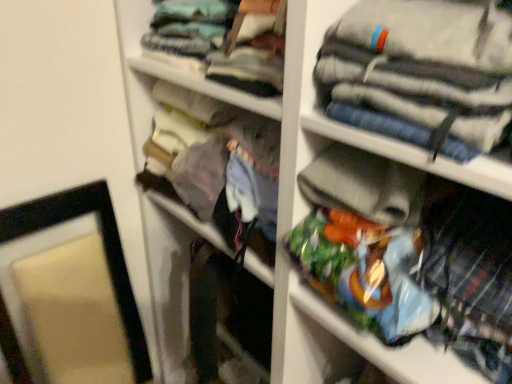
Question: In terms of height, does matte black picture frame at left look taller or shorter compared to light blue fabric at upper center, which is the 1th clothing in top-to-bottom order?

Choices:
 (A) short
 (B) tall

Answer: (B)

Question: Would you say matte black picture frame at left is to the left or to the right of light blue fabric at upper center, which is the 1th clothing in top-to-bottom order, in the picture?

Choices:
 (A) left
 (B) right

Answer: (A)

Question: Estimate the real-world distances between objects in this image. Which object is closer to the matte black picture frame at left?

Choices:
 (A) light blue fabric at upper center, which is the 1th clothing in top-to-bottom order
 (B) matte fabric purse at center
 (C) plaid fabric shirt at lower right, which is the 3th clothing in top-to-bottom order
 (D) striped cotton pants at upper right, the second clothing when ordered from top to bottom

Answer: (B)

Question: Which object is the farthest from the light blue fabric at upper center, which is the 1th clothing in top-to-bottom order?

Choices:
 (A) plaid fabric shirt at lower right, which is the 3th clothing in top-to-bottom order
 (B) matte black picture frame at left
 (C) striped cotton pants at upper right, acting as the second clothing starting from the bottom
 (D) matte fabric purse at center

Answer: (B)